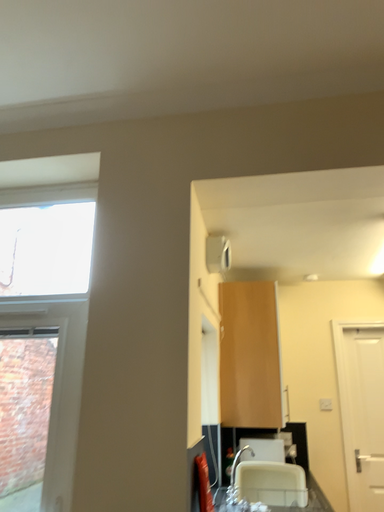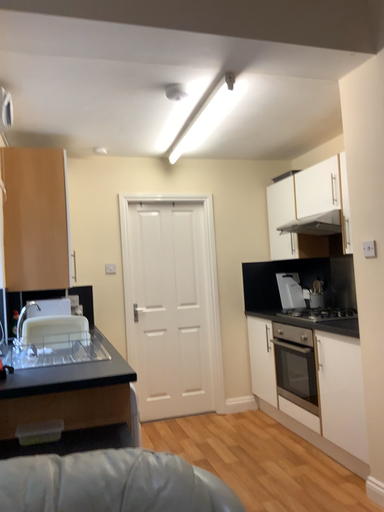
Question: How did the camera likely rotate when shooting the video?

Choices:
 (A) rotated upward
 (B) rotated downward

Answer: (B)